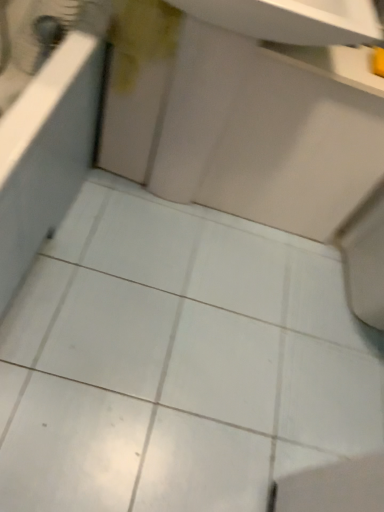
Image resolution: width=384 pixels, height=512 pixels. What do you see at coordinates (266, 135) in the screenshot? I see `white glossy sink at center` at bounding box center [266, 135].

Identify the location of white glossy sink at center. (266, 135).

Describe the element at coordinates (47, 122) in the screenshot. I see `white glossy bath at left` at that location.

The image size is (384, 512). Find the location of `white glossy bath at left`. white glossy bath at left is located at coordinates (47, 122).

What are the coordinates of `white glossy sink at center` in the screenshot? It's located at (266, 135).

Which object is positioned more to the right, white glossy bath at left or white glossy sink at center?

From the viewer's perspective, white glossy sink at center appears more on the right side.

Considering their positions, is white glossy bath at left located in front of or behind white glossy sink at center?

Visually, white glossy bath at left is located in front of white glossy sink at center.

Considering the positions of point (23, 185) and point (273, 216), is point (23, 185) closer or farther from the camera than point (273, 216)?

Point (23, 185) appears to be closer to the viewer than point (273, 216).

From the image's perspective, is white glossy bath at left located above or below white glossy sink at center?

Based on their image positions, white glossy bath at left is located beneath white glossy sink at center.

From a real-world perspective, which is physically below, white glossy bath at left or white glossy sink at center?

white glossy bath at left, from a real-world perspective.

Considering the relative sizes of white glossy bath at left and white glossy sink at center in the image provided, is white glossy bath at left wider than white glossy sink at center?

Correct, the width of white glossy bath at left exceeds that of white glossy sink at center.

Considering the relative sizes of white glossy bath at left and white glossy sink at center in the image provided, is white glossy bath at left shorter than white glossy sink at center?

Yes, white glossy bath at left is shorter than white glossy sink at center.

Does white glossy bath at left have a smaller size compared to white glossy sink at center?

No, white glossy bath at left is not smaller than white glossy sink at center.

Is white glossy bath at left inside or outside of white glossy sink at center?

white glossy bath at left cannot be found inside white glossy sink at center.

Is white glossy bath at left next to white glossy sink at center?

white glossy bath at left is not next to white glossy sink at center, and they're not touching.

Is white glossy bath at left turned away from white glossy sink at center?

No, white glossy bath at left's orientation is not away from white glossy sink at center.

Where is `bath on the left of white glossy sink at center`? The height and width of the screenshot is (512, 384). bath on the left of white glossy sink at center is located at coordinates (47, 122).

From the picture: Which is more to the left, white glossy sink at center or white glossy bath at left?

Positioned to the left is white glossy bath at left.

Is white glossy sink at center positioned behind white glossy bath at left?

Yes, it is behind white glossy bath at left.

Which is in front, point (242, 115) or point (0, 315)?

The point (0, 315) is closer.

From the image's perspective, between white glossy sink at center and white glossy bath at left, who is located below?

From the image's view, white glossy bath at left is below.

From a real-world perspective, is white glossy sink at center above or below white glossy bath at left?

Clearly, from a real-world perspective, white glossy sink at center is above white glossy bath at left.

Which object is wider, white glossy sink at center or white glossy bath at left?

white glossy bath at left.

Between white glossy sink at center and white glossy bath at left, which one has more height?

Standing taller between the two is white glossy sink at center.

Considering the sizes of objects white glossy sink at center and white glossy bath at left in the image provided, who is bigger, white glossy sink at center or white glossy bath at left?

With larger size is white glossy bath at left.

Can we say white glossy sink at center lies outside white glossy bath at left?

Yes, white glossy sink at center is not within white glossy bath at left.

Looking at this image, are white glossy sink at center and white glossy bath at left beside each other?

No, white glossy sink at center is not touching white glossy bath at left.

Is white glossy sink at center facing towards white glossy bath at left?

No, white glossy sink at center does not turn towards white glossy bath at left.

This screenshot has width=384, height=512. Find the location of `bath below the white glossy sink at center (from the image's perspective)`. bath below the white glossy sink at center (from the image's perspective) is located at coordinates (47, 122).

Locate an element on the screen. This screenshot has height=512, width=384. bath lying on the left of white glossy sink at center is located at coordinates (47, 122).

Where is `sink that appears above the white glossy bath at left (from a real-world perspective)`? sink that appears above the white glossy bath at left (from a real-world perspective) is located at coordinates (266, 135).